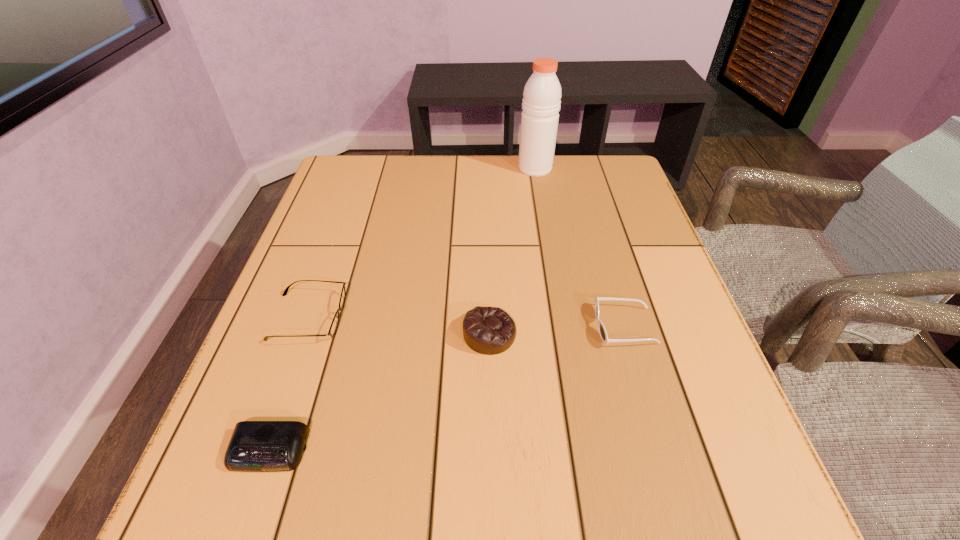
Where is `free space at the left edge of the desktop`? Image resolution: width=960 pixels, height=540 pixels. free space at the left edge of the desktop is located at coordinates (292, 306).

Where is `free space at the right edge`? free space at the right edge is located at coordinates (634, 247).

Where is `vacant space at the far left corner of the desktop`? Image resolution: width=960 pixels, height=540 pixels. vacant space at the far left corner of the desktop is located at coordinates (337, 201).

In the image, there is a desktop. Where is `free space at the near left corner`? The image size is (960, 540). free space at the near left corner is located at coordinates (205, 490).

The width and height of the screenshot is (960, 540). Identify the location of free space at the far right corner of the desktop. (610, 163).

Identify the location of free point between the farthest object and the spectacles. This screenshot has height=540, width=960. tap(421, 242).

Where is `empty space that is in between the shaker and the rightmost object`? empty space that is in between the shaker and the rightmost object is located at coordinates (580, 247).

What are the coordinates of `free spot between the second object from right to left and the spectacles` in the screenshot? It's located at (421, 242).

Where is `vacant space in between the spectacles and the alarm clock`? The width and height of the screenshot is (960, 540). vacant space in between the spectacles and the alarm clock is located at coordinates (289, 384).

You are a GUI agent. You are given a task and a screenshot of the screen. Output one action in this format:
    pyautogui.click(x=<x>, y=<y>)
    Task: Click on the vacant space that is in between the sunglasses and the third object from right to left
    Image resolution: width=960 pixels, height=540 pixels.
    Given the screenshot: What is the action you would take?
    pyautogui.click(x=557, y=330)